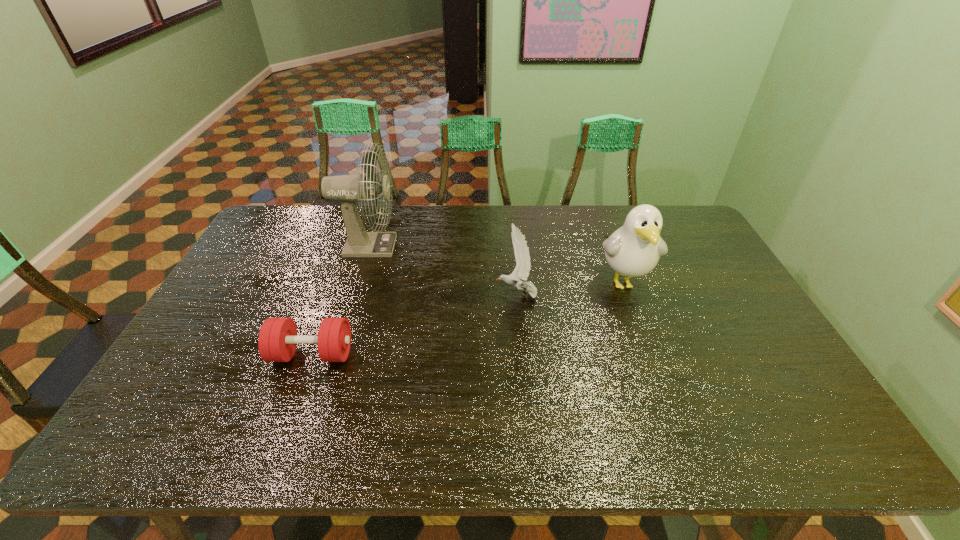
Locate an element on the screen. vacant area that lies between the second tallest object and the second object from right to left is located at coordinates (570, 289).

Identify the location of vacant space that's between the nearest object and the right gull. (468, 318).

You are a GUI agent. You are given a task and a screenshot of the screen. Output one action in this format:
    pyautogui.click(x=<x>, y=<y>)
    Task: Click on the free space between the tallest object and the second tallest object
    Image resolution: width=960 pixels, height=540 pixels.
    Given the screenshot: What is the action you would take?
    pyautogui.click(x=495, y=264)

I want to click on empty space between the nearest object and the tallest object, so click(x=340, y=300).

The width and height of the screenshot is (960, 540). I want to click on empty location between the tallest object and the right gull, so click(x=495, y=264).

I want to click on free spot between the right gull and the nearest object, so click(468, 318).

The image size is (960, 540). Identify the location of vacant area between the taller gull and the left gull. (570, 289).

Where is `vacant space that is in between the shortest object and the tallest object`? This screenshot has height=540, width=960. vacant space that is in between the shortest object and the tallest object is located at coordinates (340, 300).

Identify the location of object that is the third closest to the fan. (633, 250).

At what (x,y) coordinates should I click in order to perform the action: click on object that ranks as the closest to the third tallest object. Please return your answer as a coordinate pair (x, y). Looking at the image, I should click on (633, 250).